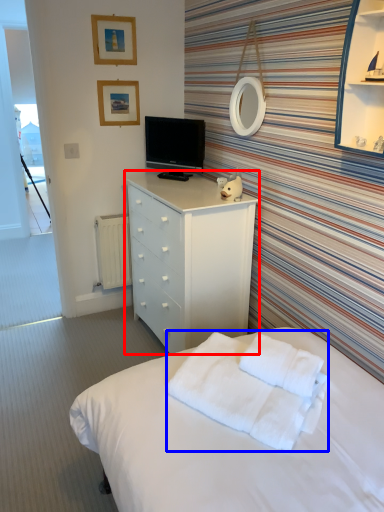
Question: Which object is closer to the camera taking this photo, chest of drawers (highlighted by a red box) or blanket (highlighted by a blue box)?

Choices:
 (A) chest of drawers
 (B) blanket

Answer: (B)